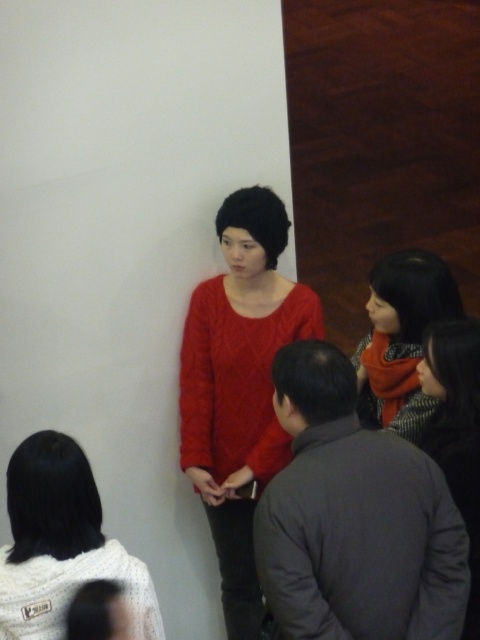
Who is positioned more to the right, white fuzzy sweater at lower left or matte red scarf at center?

From the viewer's perspective, matte red scarf at center appears more on the right side.

Does white fuzzy sweater at lower left have a greater width compared to matte red scarf at center?

Correct, the width of white fuzzy sweater at lower left exceeds that of matte red scarf at center.

Does point (144, 609) lie behind point (408, 371)?

No, it is in front of (408, 371).

Where is `white fuzzy sweater at lower left`? white fuzzy sweater at lower left is located at coordinates click(x=60, y=544).

Based on the photo, is white fuzzy sweater at lower left to the right of dark gray sweater at lower right from the viewer's perspective?

In fact, white fuzzy sweater at lower left is to the left of dark gray sweater at lower right.

How far apart are white fuzzy sweater at lower left and dark gray sweater at lower right?

white fuzzy sweater at lower left and dark gray sweater at lower right are 3.48 feet apart.

What are the coordinates of `white fuzzy sweater at lower left` in the screenshot? It's located at (60, 544).

Is matte red scarf at center to the left of dark gray sweater at lower right from the viewer's perspective?

Yes, matte red scarf at center is to the left of dark gray sweater at lower right.

Which is more to the right, matte red scarf at center or dark gray sweater at lower right?

From the viewer's perspective, dark gray sweater at lower right appears more on the right side.

Is point (394, 336) positioned in front of point (427, 356)?

No, (394, 336) is further to viewer.

The image size is (480, 640). Find the location of `matte red scarf at center`. matte red scarf at center is located at coordinates (400, 339).